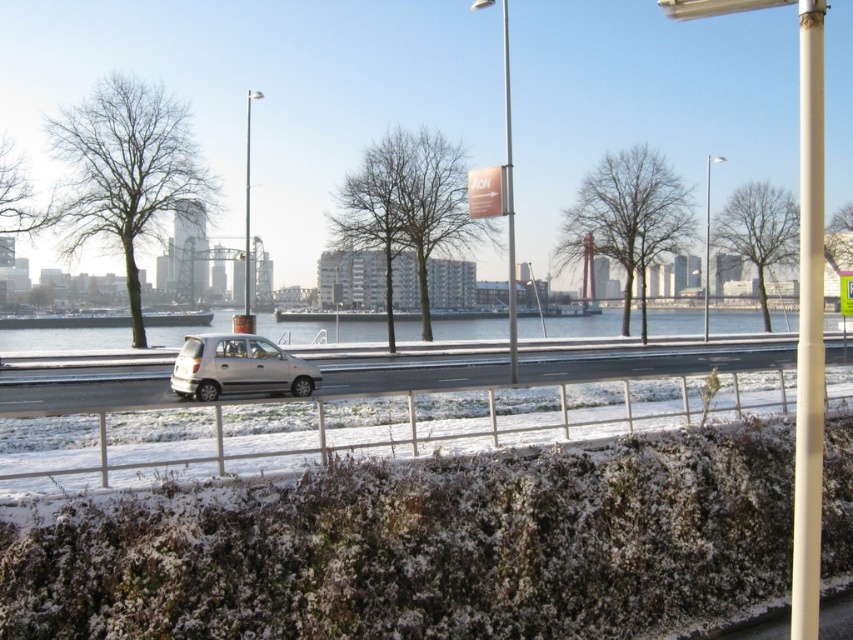
You are standing at the point with coordinates (x=238, y=368) in the winter waterfront scene. What object is located exactly at this point?

The silver metallic car at center is located exactly at point (x=238, y=368).

You are a photographer trying to capture the city skyline in the background. You notice the white smooth pole at right and the silver metallic car at center are blocking your view. Which object is wider and might be causing more obstruction?

The white smooth pole at right is wider than the silver metallic car at center, so it might be causing more obstruction to the city skyline view.